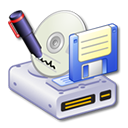
You are a GUI agent. You are given a task and a screenshot of the screen. Output one action in this format:
    pyautogui.click(x=<x>, y=<y>)
    Task: Click on the cd / compact dish
    
    Given the screenshot: What is the action you would take?
    pyautogui.click(x=59, y=61)